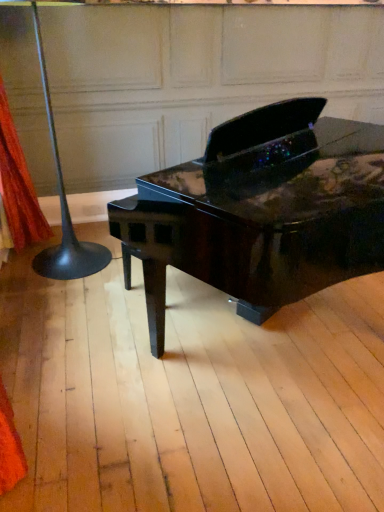
You are a GUI agent. You are given a task and a screenshot of the screen. Output one action in this format:
    pyautogui.click(x=<x>, y=<y>)
    Task: Click on the free location in front of orange fabric at left
    The height and width of the screenshot is (512, 384).
    Given the screenshot: What is the action you would take?
    pyautogui.click(x=27, y=286)